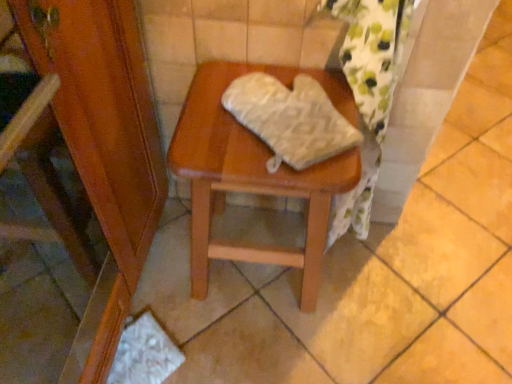
At what (x,y) coordinates should I click in order to perform the action: click on unoccupied region to the right of wooden stool at center. Please return your answer as a coordinate pair (x, y). Looking at the image, I should click on (383, 296).